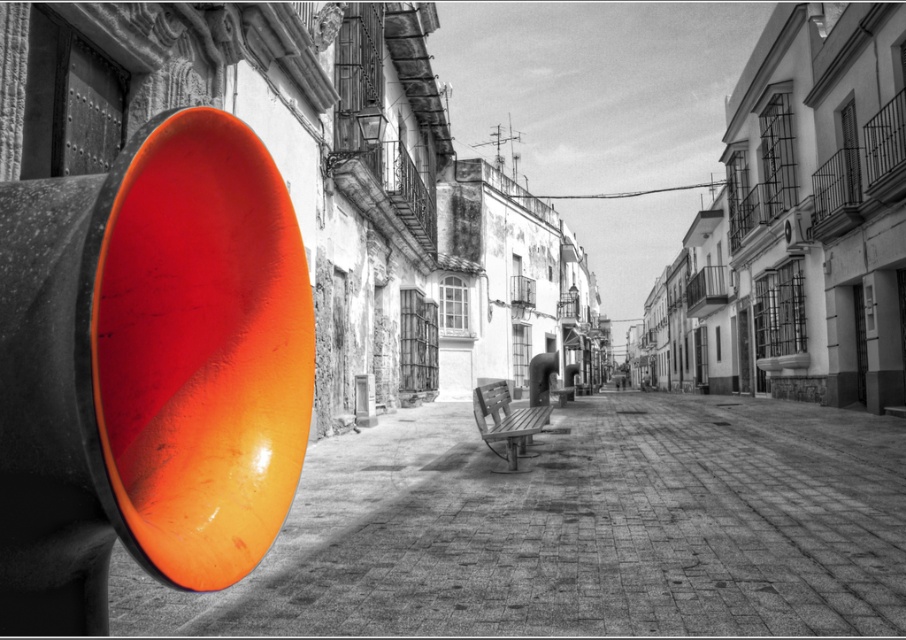
You are a delivery person with a cart that is 1.5 meters wide. You need to move from the glossy orange disc at left to the wooden bench at center. Is there enough space between them for your cart to pass through?

The glossy orange disc at left is 4.31 meters away from the wooden bench at center. Since the cart is only 1.5 meters wide, there is sufficient space for the cart to pass between them.

You are a delivery person with a cart that is 1.5 meters wide. You are on a narrow street and need to pass between the glossy orange disc at left and the glossy orange traffic light at left. Can your cart fit through the space between them?

The glossy orange disc at left is 3.95 meters away from the glossy orange traffic light at left. Since the distance between them is greater than the cart width of 1.5 meters, the cart can fit through the space between them.